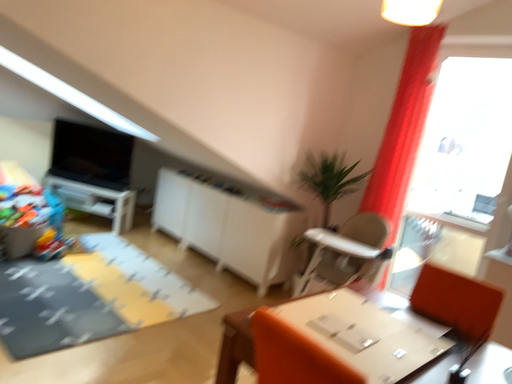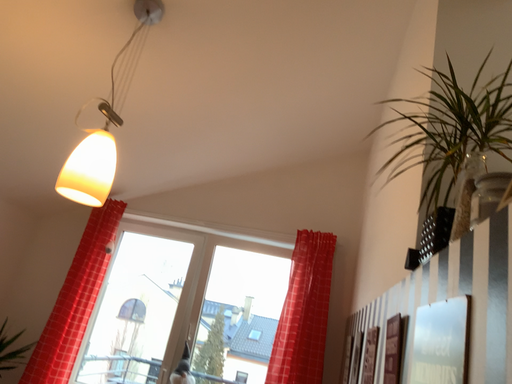
Question: Which way did the camera rotate in the video?

Choices:
 (A) rotated right
 (B) rotated left

Answer: (A)